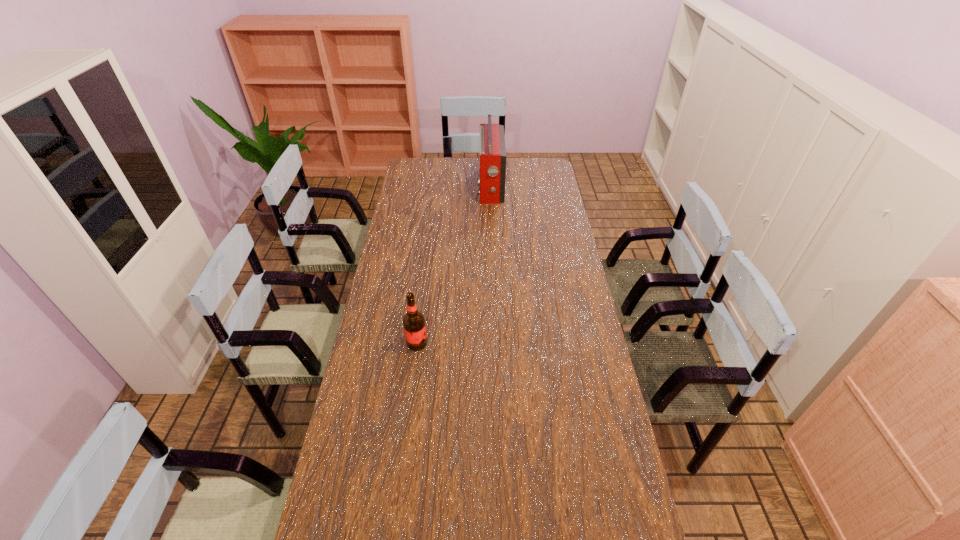
Locate an element on the screen. free point at the far edge is located at coordinates (475, 163).

I want to click on free region at the left edge of the desktop, so (394, 309).

Where is `free space at the right edge of the desktop`? free space at the right edge of the desktop is located at coordinates (547, 194).

Identify the location of vacant space at the far right corner of the desktop. This screenshot has height=540, width=960. (539, 158).

At what (x,y) coordinates should I click in order to perform the action: click on free spot between the farther object and the left object. Please return your answer as a coordinate pair (x, y). This screenshot has height=540, width=960. Looking at the image, I should click on (454, 265).

Locate an element on the screen. vacant area that lies between the root beer and the farther object is located at coordinates (454, 265).